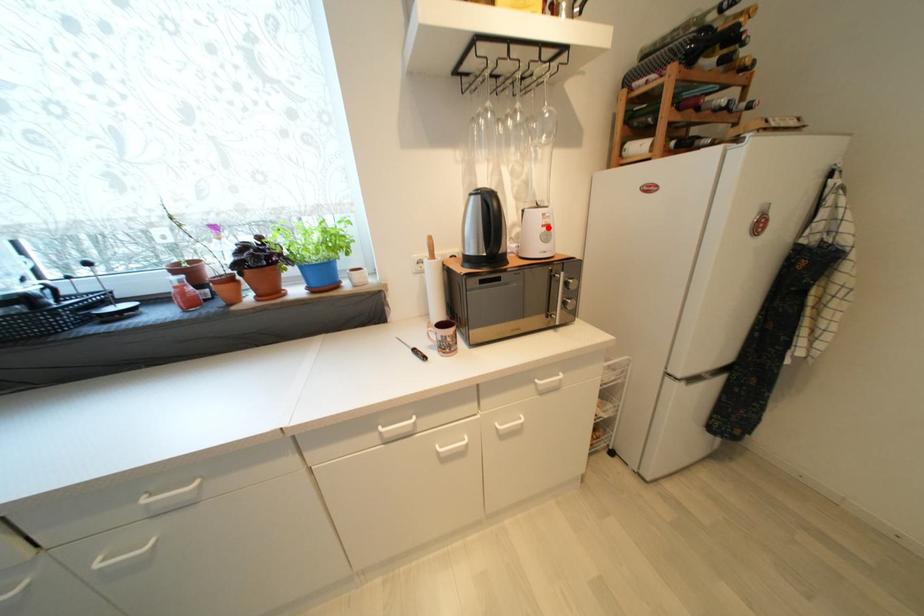
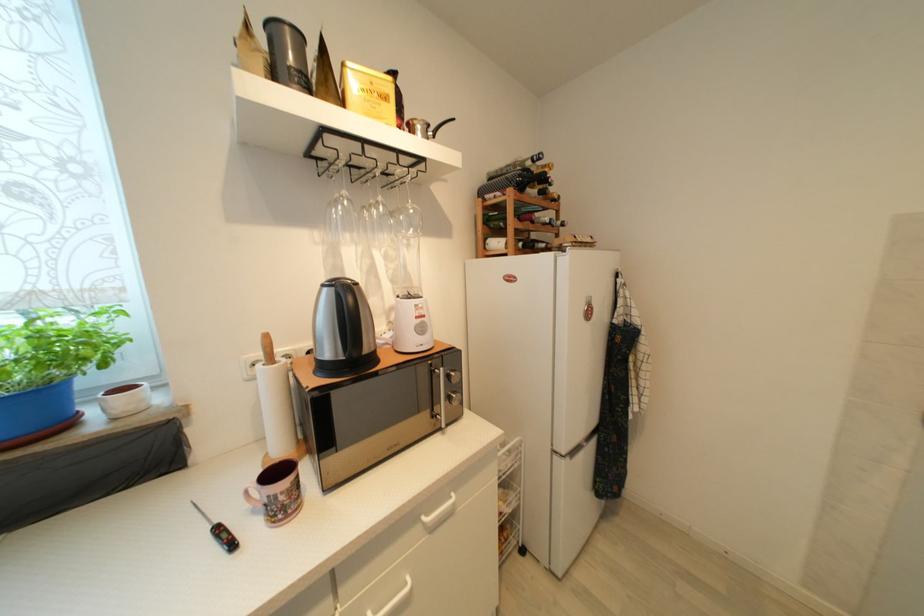
The point at the highlighted location is marked in the first image. Where is the corresponding point in the second image?

(421, 320)